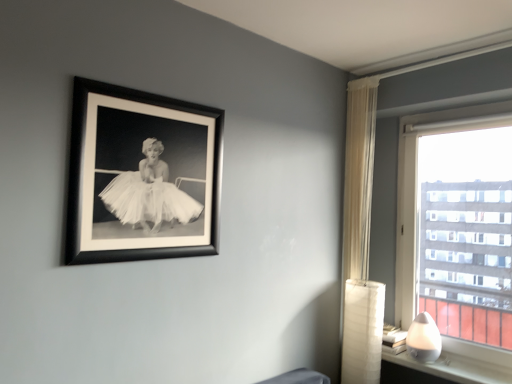
Question: Is black matte picture frame at upper left in contact with white glossy lamp at lower right?

Choices:
 (A) yes
 (B) no

Answer: (B)

Question: Is black matte picture frame at upper left to the right of white glossy lamp at lower right from the viewer's perspective?

Choices:
 (A) no
 (B) yes

Answer: (A)

Question: Does black matte picture frame at upper left have a smaller size compared to white glossy lamp at lower right?

Choices:
 (A) yes
 (B) no

Answer: (B)

Question: Could you tell me if black matte picture frame at upper left is facing white glossy lamp at lower right?

Choices:
 (A) yes
 (B) no

Answer: (B)

Question: Does black matte picture frame at upper left have a greater width compared to white glossy lamp at lower right?

Choices:
 (A) yes
 (B) no

Answer: (B)

Question: Does black matte picture frame at upper left have a greater height compared to white glossy lamp at lower right?

Choices:
 (A) yes
 (B) no

Answer: (A)

Question: Is white glossy lamp at lower right looking in the opposite direction of black matte picture frame at upper left?

Choices:
 (A) yes
 (B) no

Answer: (B)

Question: Does white glossy lamp at lower right appear on the left side of black matte picture frame at upper left?

Choices:
 (A) yes
 (B) no

Answer: (B)

Question: Is white glossy lamp at lower right further to camera compared to black matte picture frame at upper left?

Choices:
 (A) yes
 (B) no

Answer: (A)

Question: Does white glossy lamp at lower right have a larger size compared to black matte picture frame at upper left?

Choices:
 (A) yes
 (B) no

Answer: (B)

Question: Is white glossy lamp at lower right positioned beyond the bounds of black matte picture frame at upper left?

Choices:
 (A) yes
 (B) no

Answer: (A)

Question: Does white glossy lamp at lower right have a greater height compared to black matte picture frame at upper left?

Choices:
 (A) yes
 (B) no

Answer: (B)

Question: Does sheer white curtain at right touch white glossy lamp at lower right?

Choices:
 (A) no
 (B) yes

Answer: (A)